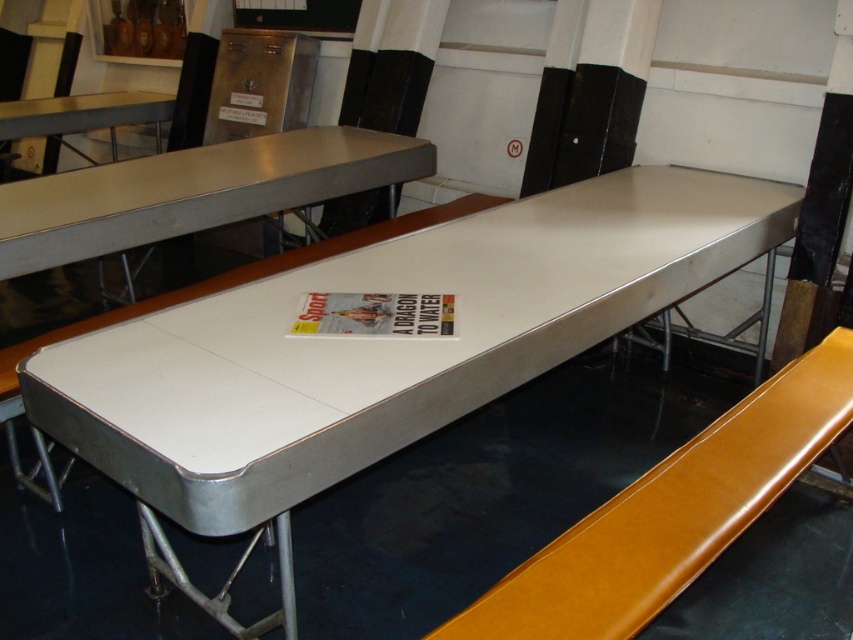
You are sitting on the matte yellow bench at center and want to place a book on the white glossy table at center. Is the table high enough for you to reach comfortably?

The white glossy table at center is much taller than the matte yellow bench at center, so you might have to stretch or stand up to reach it comfortably.

You are standing at the entrance of the dining area and see the point at coordinates (x=671, y=513). What object is this point located on?

The point at coordinates (x=671, y=513) is located on the matte yellow bench at center.

You are standing in the room and want to place a small vase on the white glossy table at center. Based on the coordinates provided, can you confirm if the point marked as point (x=383, y=344) is the correct location for the table?

Yes, the white glossy table at center is represented by point (x=383, y=344), so placing the vase at that coordinate would be correct.